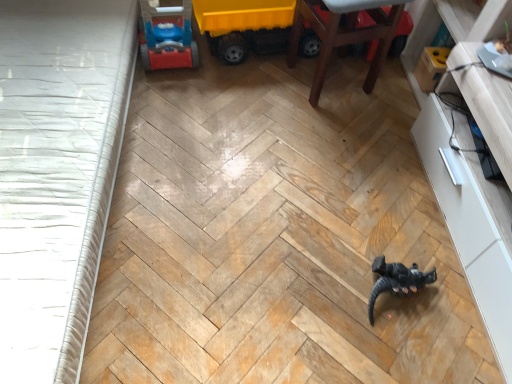
Identify the location of free point below black matte dinosaur at center, which is the 2th toy in top-to-bottom order (from a real-world perspective). This screenshot has width=512, height=384. [x=400, y=292].